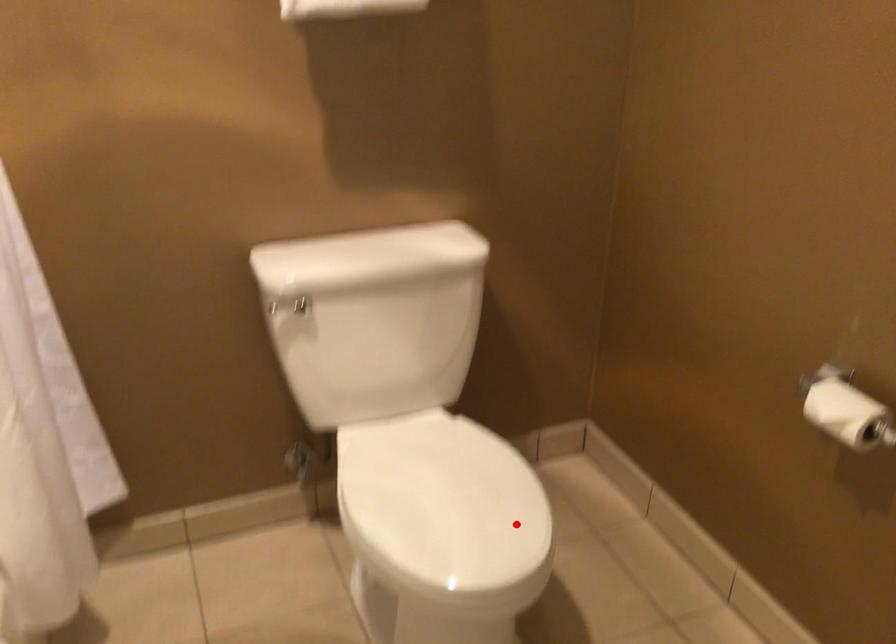
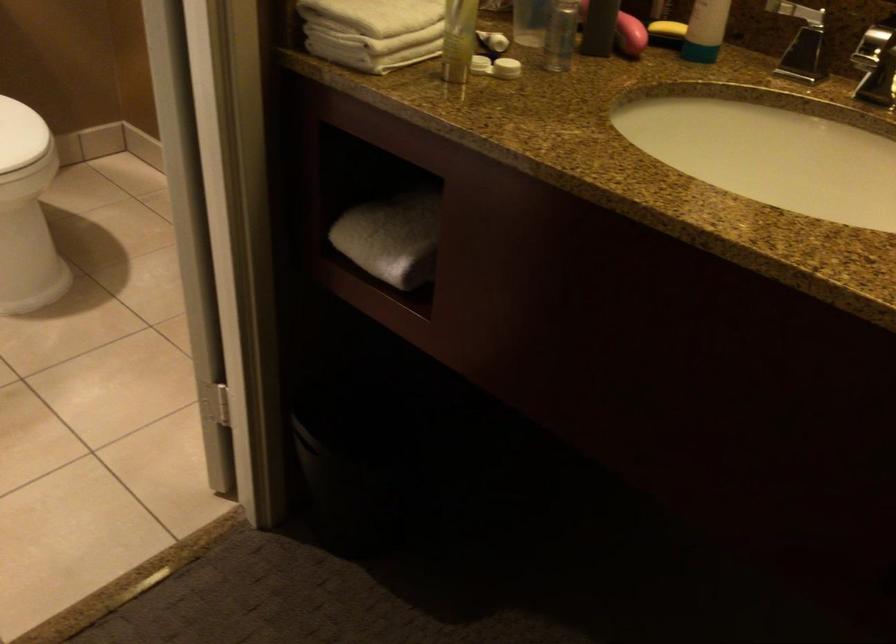
Locate, in the second image, the point that corresponds to the highlighted location in the first image.

(20, 135)